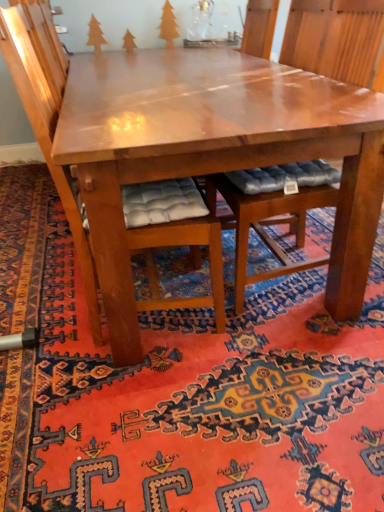
Identify the location of vacant area that lies to the right of wooden cushioned chair at center, acting as the second chair starting from the right. (285, 345).